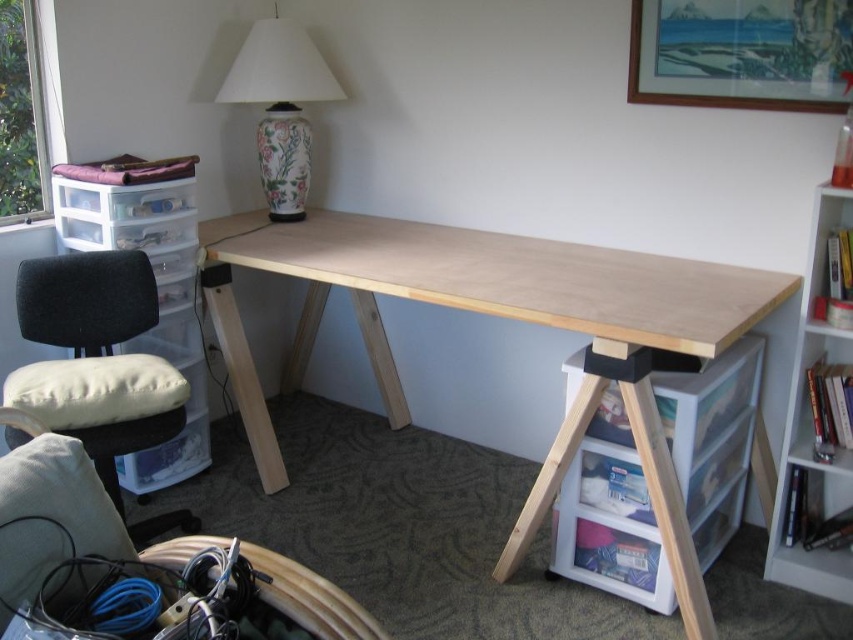
Question: Where is white wood bookshelf at right located in relation to velvet black swivel chair at left in the image?

Choices:
 (A) right
 (B) left

Answer: (A)

Question: Which point is farther from the camera taking this photo?

Choices:
 (A) (271, 177)
 (B) (602, 250)
 (C) (778, 477)
 (D) (76, 339)

Answer: (A)

Question: Is white wood bookshelf at right below velvet black swivel chair at left?

Choices:
 (A) no
 (B) yes

Answer: (B)

Question: Which object appears farthest from the camera in this image?

Choices:
 (A) white wood bookshelf at right
 (B) porcelain floral lamp at upper center
 (C) velvet black swivel chair at left

Answer: (B)

Question: Does natural wood table at center appear on the right side of velvet black swivel chair at left?

Choices:
 (A) no
 (B) yes

Answer: (B)

Question: Which point is farther from the camera taking this photo?

Choices:
 (A) (805, 332)
 (B) (288, 164)
 (C) (26, 321)

Answer: (B)